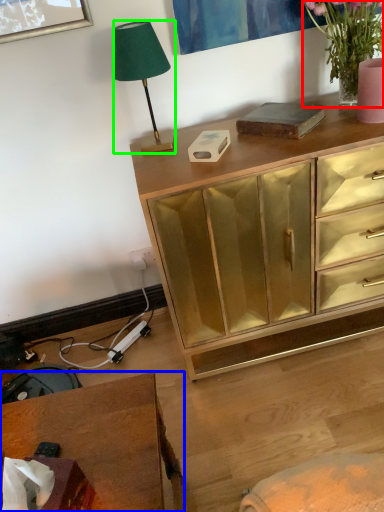
Question: Estimate the real-world distances between objects in this image. Which object is closer to houseplant (highlighted by a red box), desk (highlighted by a blue box) or lamp (highlighted by a green box)?

Choices:
 (A) desk
 (B) lamp

Answer: (B)